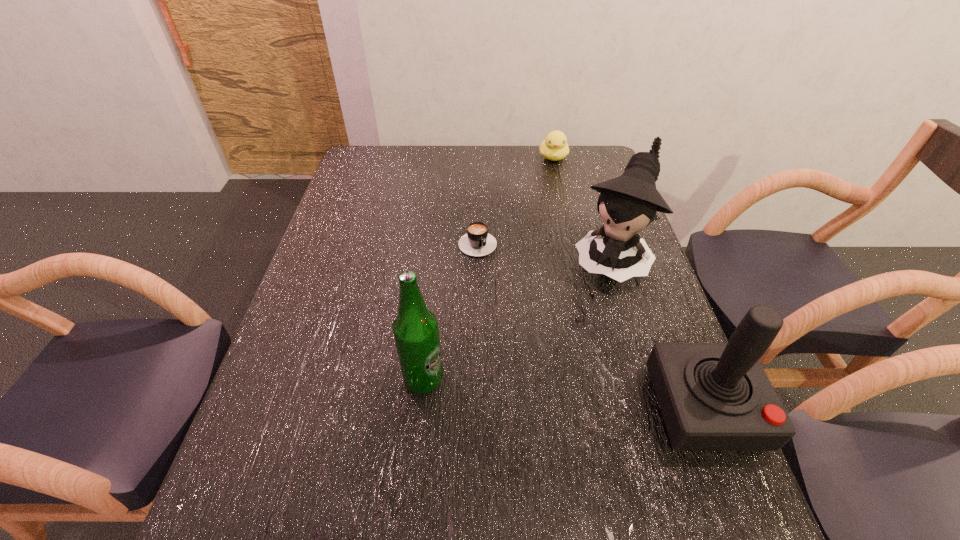
Locate an element on the screen. The width and height of the screenshot is (960, 540). vacant position located at the beak of the farthest object is located at coordinates (562, 199).

Locate an element on the screen. Image resolution: width=960 pixels, height=540 pixels. free location located 0.350m with the handle on the side of the shortest object is located at coordinates (543, 352).

You are a GUI agent. You are given a task and a screenshot of the screen. Output one action in this format:
    pyautogui.click(x=<x>, y=<y>)
    Task: Click on the vacant space located 0.380m with the handle on the side of the shortest object
    This screenshot has height=540, width=960.
    Given the screenshot: What is the action you would take?
    pyautogui.click(x=549, y=362)

This screenshot has height=540, width=960. In order to click on free region located with the handle on the side of the shortest object in this screenshot , I will do `click(516, 306)`.

The width and height of the screenshot is (960, 540). I want to click on blank area located 0.240m at the face of the doll, so coord(562,356).

Locate an element on the screen. This screenshot has height=540, width=960. blank area located at the face of the doll is located at coordinates (550, 375).

The image size is (960, 540). What are the coordinates of `vacant point located at the face of the doll` in the screenshot? It's located at (544, 386).

The image size is (960, 540). I want to click on object situated at the far edge, so click(x=554, y=147).

In order to click on object that is at the near edge in this screenshot , I will do `click(713, 396)`.

Identify the location of joystick that is at the right edge. Image resolution: width=960 pixels, height=540 pixels. (713, 396).